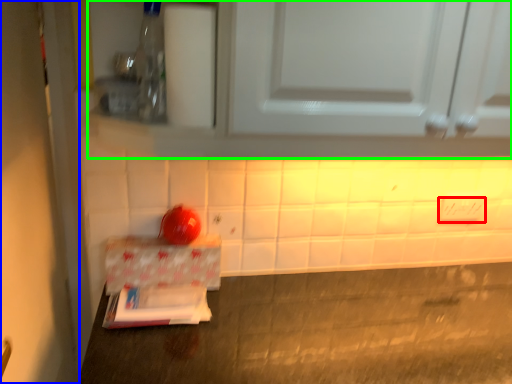
Question: Which object is positioned farthest from electric outlet (highlighted by a red box)? Select from door (highlighted by a blue box) and cabinetry (highlighted by a green box).

Choices:
 (A) door
 (B) cabinetry

Answer: (A)